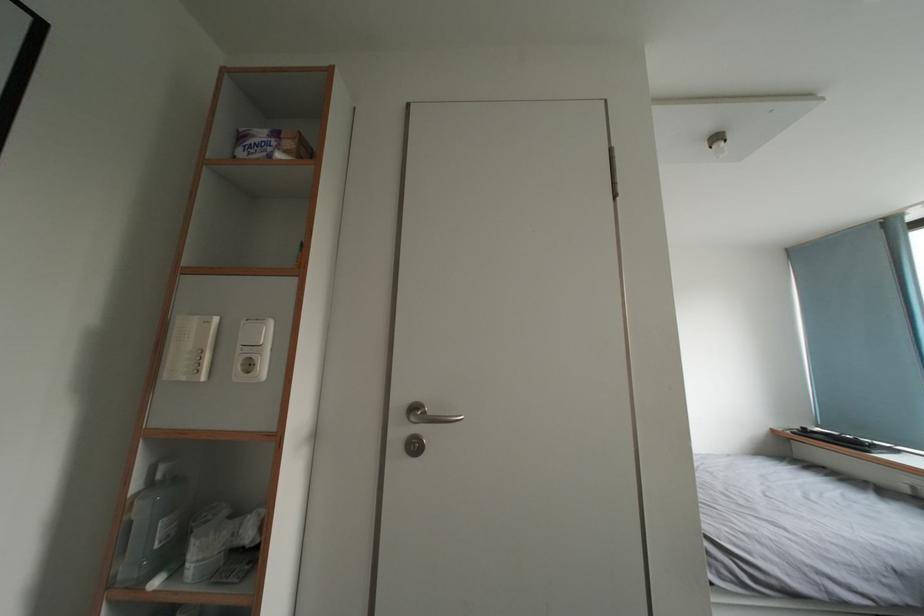
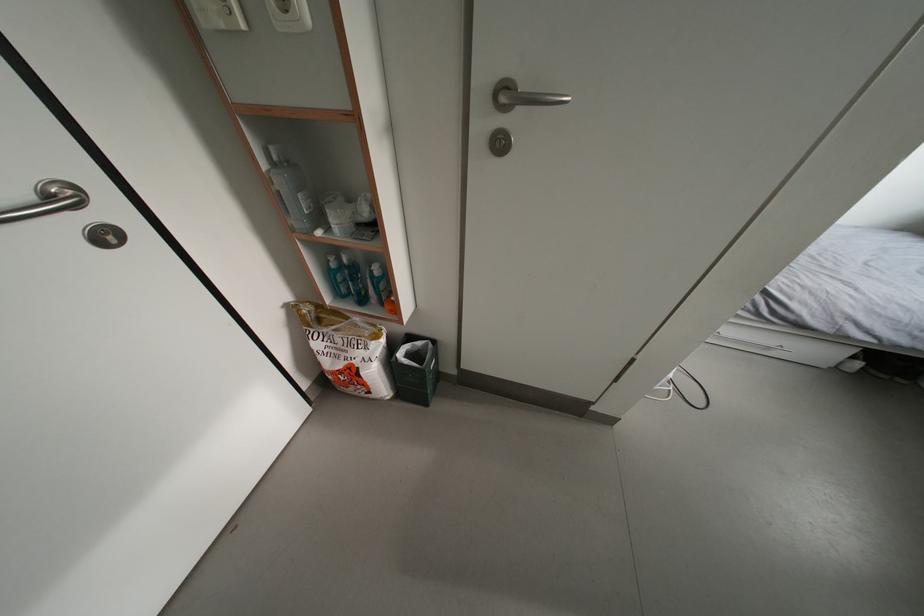
The point at (190,383) is marked in the first image. Where is the corresponding point in the second image?

(229, 30)